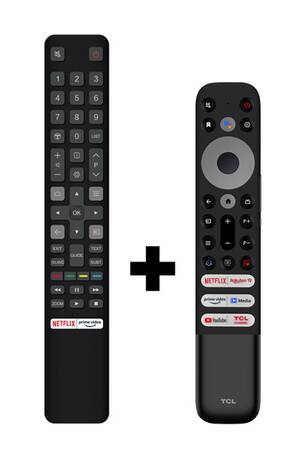
Locate an element on the screen. remote number buttons is located at coordinates (57, 78), (78, 78), (94, 78), (95, 95), (76, 97), (57, 97), (57, 116), (76, 117), (96, 116), (80, 135).